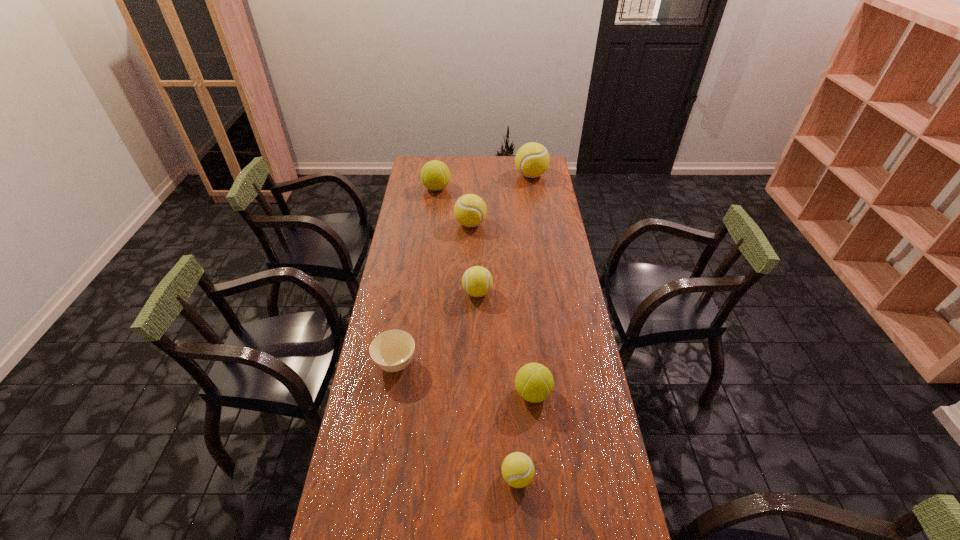
You are a GUI agent. You are given a task and a screenshot of the screen. Output one action in this format:
    pyautogui.click(x=<x>, y=<y>)
    Task: Click on the vacant area in the image that satisfies the following two spatial constraints: 1. on the back side of the sugar bowl; 2. on the right side of the rightmost yellow tennis ball
    Image resolution: width=960 pixels, height=540 pixels.
    Given the screenshot: What is the action you would take?
    pyautogui.click(x=426, y=175)

At what (x,y) coordinates should I click in order to perform the action: click on vacant space that satisfies the following two spatial constraints: 1. on the front side of the leftmost tennis ball; 2. on the left side of the third farthest yellow tennis ball. Please return your answer as a coordinate pair (x, y). The height and width of the screenshot is (540, 960). Looking at the image, I should click on (422, 293).